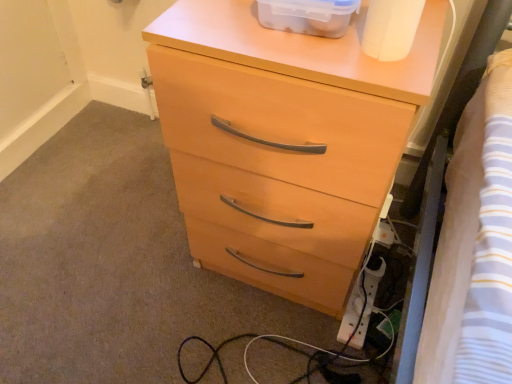
Where is `vacant area that lies in front of translucent plastic container at upper center`? The width and height of the screenshot is (512, 384). vacant area that lies in front of translucent plastic container at upper center is located at coordinates (324, 62).